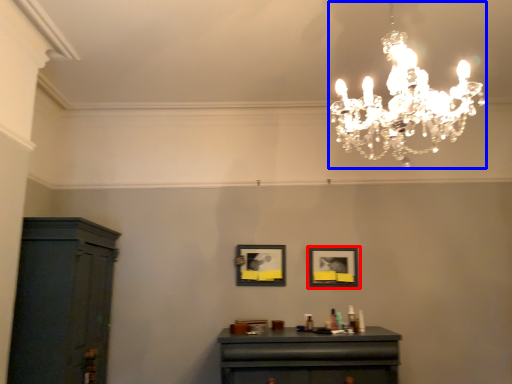
Question: Which point is closer to the camera, picture frame (highlighted by a red box) or lamp (highlighted by a blue box)?

Choices:
 (A) picture frame
 (B) lamp

Answer: (B)